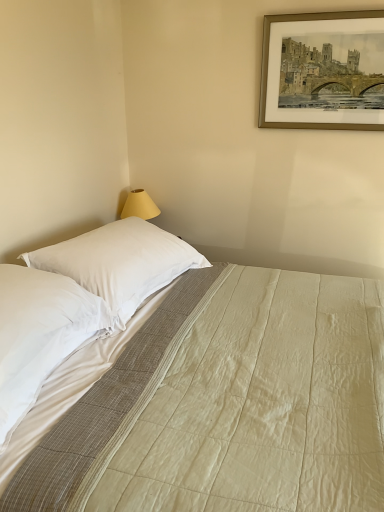
Question: Is white cotton bed at center taller or shorter than gold metallic picture frame at upper right?

Choices:
 (A) tall
 (B) short

Answer: (A)

Question: Considering the positions of white cotton bed at center and gold metallic picture frame at upper right in the image, is white cotton bed at center bigger or smaller than gold metallic picture frame at upper right?

Choices:
 (A) big
 (B) small

Answer: (A)

Question: Which is farther from the gold metallic picture frame at upper right?

Choices:
 (A) white soft pillow at left, arranged as the first pillow when viewed from the front
 (B) white smooth pillow at upper left, the 1th pillow from the back
 (C) white cotton bed at center

Answer: (A)

Question: Estimate the real-world distances between objects in this image. Which object is farther from the white smooth pillow at upper left, which appears as the 2th pillow when viewed from the front?

Choices:
 (A) white cotton bed at center
 (B) gold metallic picture frame at upper right
 (C) white soft pillow at left, arranged as the first pillow when viewed from the front

Answer: (B)